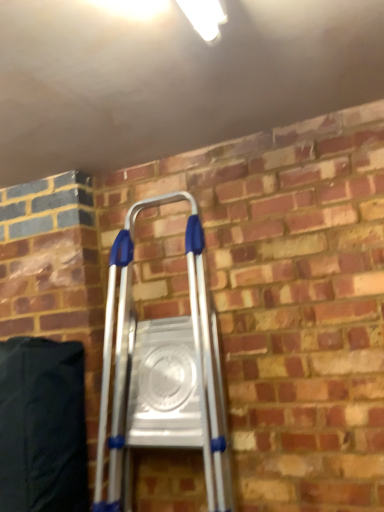
The width and height of the screenshot is (384, 512). Find the location of `silver metallic ladder at center`. silver metallic ladder at center is located at coordinates (162, 374).

Describe the element at coordinates (162, 374) in the screenshot. Image resolution: width=384 pixels, height=512 pixels. I see `silver metallic ladder at center` at that location.

Measure the distance between black fabric bean bag chair at lower left and camera.

black fabric bean bag chair at lower left is 3.67 feet from camera.

Where is `black fabric bean bag chair at lower left`? The height and width of the screenshot is (512, 384). black fabric bean bag chair at lower left is located at coordinates (42, 426).

The image size is (384, 512). What do you see at coordinates (42, 426) in the screenshot?
I see `black fabric bean bag chair at lower left` at bounding box center [42, 426].

This screenshot has width=384, height=512. I want to click on silver metallic ladder at center, so click(162, 374).

From the picture: Does black fabric bean bag chair at lower left appear on the right side of silver metallic ladder at center?

No, black fabric bean bag chair at lower left is not to the right of silver metallic ladder at center.

Considering the positions of objects black fabric bean bag chair at lower left and silver metallic ladder at center in the image provided, who is behind, black fabric bean bag chair at lower left or silver metallic ladder at center?

black fabric bean bag chair at lower left.

Is point (34, 499) closer to camera compared to point (166, 382)?

Yes.

From the image's perspective, who appears lower, black fabric bean bag chair at lower left or silver metallic ladder at center?

black fabric bean bag chair at lower left.

From a real-world perspective, is black fabric bean bag chair at lower left positioned over silver metallic ladder at center based on gravity?

No, from a real-world perspective, black fabric bean bag chair at lower left is not on top of silver metallic ladder at center.

Considering the sizes of black fabric bean bag chair at lower left and silver metallic ladder at center in the image, is black fabric bean bag chair at lower left wider or thinner than silver metallic ladder at center?

In the image, black fabric bean bag chair at lower left appears to be more narrow than silver metallic ladder at center.

Who is taller, black fabric bean bag chair at lower left or silver metallic ladder at center?

silver metallic ladder at center.

Can you confirm if black fabric bean bag chair at lower left is bigger than silver metallic ladder at center?

No.

Would you say black fabric bean bag chair at lower left is outside silver metallic ladder at center?

Absolutely, black fabric bean bag chair at lower left is external to silver metallic ladder at center.

Would you say black fabric bean bag chair at lower left is a long distance from silver metallic ladder at center?

They are positioned close to each other.

Is black fabric bean bag chair at lower left turned away from silver metallic ladder at center?

No, black fabric bean bag chair at lower left is not facing the opposite direction of silver metallic ladder at center.

How far apart are black fabric bean bag chair at lower left and silver metallic ladder at center?

black fabric bean bag chair at lower left and silver metallic ladder at center are 10.95 inches apart from each other.

Find the location of a particular element. The height and width of the screenshot is (512, 384). ladder in front of the black fabric bean bag chair at lower left is located at coordinates (162, 374).

Which object is positioned more to the left, silver metallic ladder at center or black fabric bean bag chair at lower left?

black fabric bean bag chair at lower left is more to the left.

Does silver metallic ladder at center lie in front of black fabric bean bag chair at lower left?

That is True.

Is point (197, 289) positioned behind point (81, 344)?

That is False.

From the image's perspective, is silver metallic ladder at center beneath black fabric bean bag chair at lower left?

No.

From a real-world perspective, is silver metallic ladder at center on top of black fabric bean bag chair at lower left?

Yes.

Is silver metallic ladder at center wider than black fabric bean bag chair at lower left?

Yes.

Considering the relative sizes of silver metallic ladder at center and black fabric bean bag chair at lower left in the image provided, is silver metallic ladder at center shorter than black fabric bean bag chair at lower left?

Incorrect, the height of silver metallic ladder at center does not fall short of that of black fabric bean bag chair at lower left.

Can you confirm if silver metallic ladder at center is bigger than black fabric bean bag chair at lower left?

Correct, silver metallic ladder at center is larger in size than black fabric bean bag chair at lower left.

Can black fabric bean bag chair at lower left be found inside silver metallic ladder at center?

No.

Would you say silver metallic ladder at center is a long distance from black fabric bean bag chair at lower left?

No, silver metallic ladder at center is in close proximity to black fabric bean bag chair at lower left.

Does silver metallic ladder at center turn towards black fabric bean bag chair at lower left?

No.

How many degrees apart are the facing directions of silver metallic ladder at center and black fabric bean bag chair at lower left?

The angular difference between silver metallic ladder at center and black fabric bean bag chair at lower left is 0.821 degrees.

How distant is silver metallic ladder at center from black fabric bean bag chair at lower left?

They are 10.95 inches apart.

Find the location of a particular element. The height and width of the screenshot is (512, 384). bean bag chair below the silver metallic ladder at center (from the image's perspective) is located at coordinates (42, 426).

Image resolution: width=384 pixels, height=512 pixels. What are the coordinates of `bean bag chair below the silver metallic ladder at center (from the image's perspective)` in the screenshot? It's located at (42, 426).

Locate an element on the screen. Image resolution: width=384 pixels, height=512 pixels. ladder that is in front of the black fabric bean bag chair at lower left is located at coordinates (162, 374).